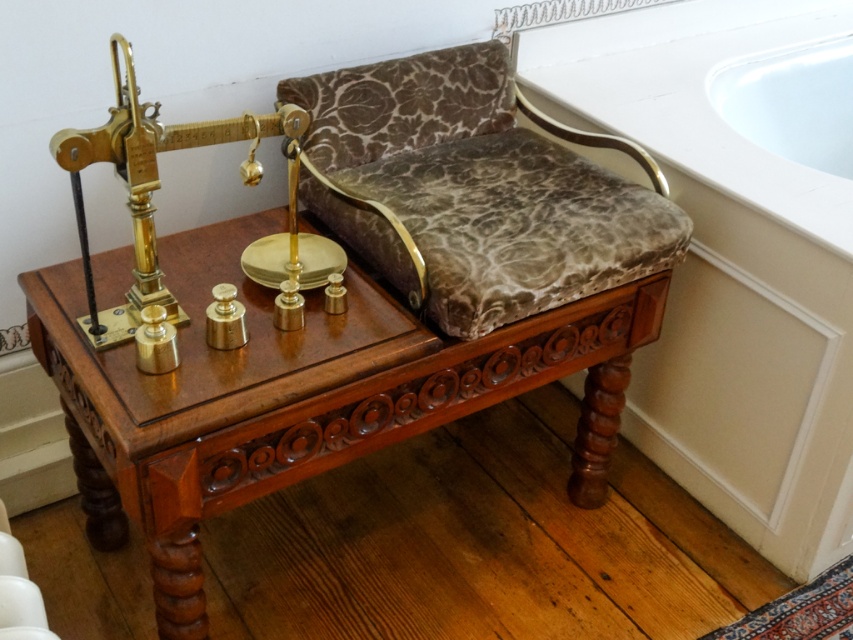
You are a furniture designer who needs to place a new sofa between the mahogany wood table at center and the white glossy bathtub at upper right. Which object should you place the sofa closer to if you want the sofa to be closer to the wider object?

The mahogany wood table at center is wider than the white glossy bathtub at upper right. Therefore, placing the sofa closer to the mahogany wood table at center ensures it is near the wider object.

You are standing at the origin point of the image coordinate system. Where is the mahogany wood table at center located in terms of coordinates?

The mahogany wood table at center is located at coordinates point [296,396].

You are a delivery person carrying a package that is 1 meter long. You need to place it between the mahogany wood table at center and the white glossy bathtub at upper right. Is there enough space?

The mahogany wood table at center and the white glossy bathtub at upper right are 90.91 centimeters apart. Since the package is 1 meter long, which is 100 centimeters, there is not enough space to place the package between them.